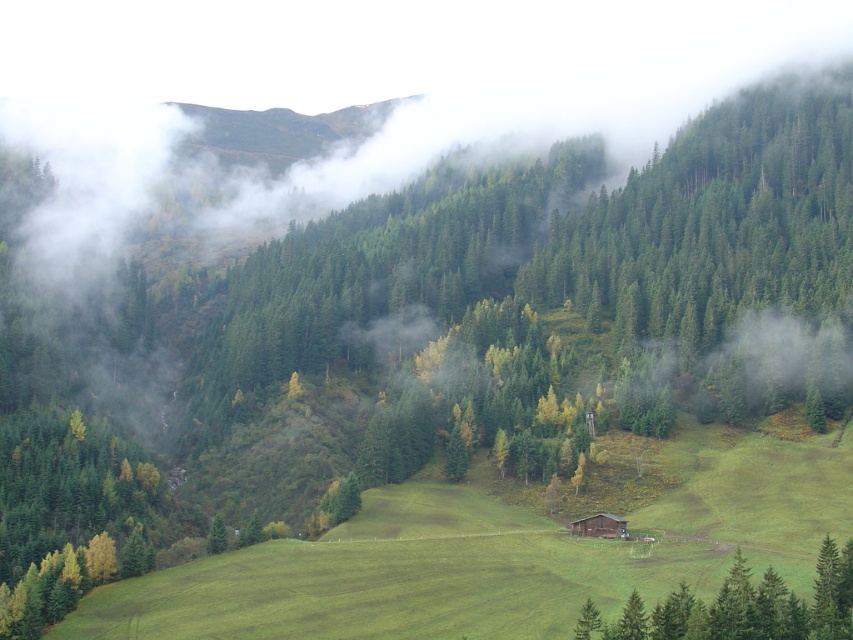
In the scene shown: You are planning to build a hiking trail between the green matte tree at lower right and the brown wooden cabin at center. The trail requires a minimum of 25 meters of space between the two points. Can the trail be constructed as planned?

The distance between the green matte tree at lower right and the brown wooden cabin at center is 27.76 meters, which exceeds the minimum requirement of 25 meters. Therefore, the trail can be constructed as planned.

You are standing in the meadow and want to take a photo of the brown wooden cabin at center. However, there is a green matte tree at lower right in your way. Can you move to the left or right to avoid the tree and still see the cabin?

The green matte tree at lower right is in front of the brown wooden cabin at center, so moving to the left or right might allow you to position yourself around the tree while still keeping the cabin in view.